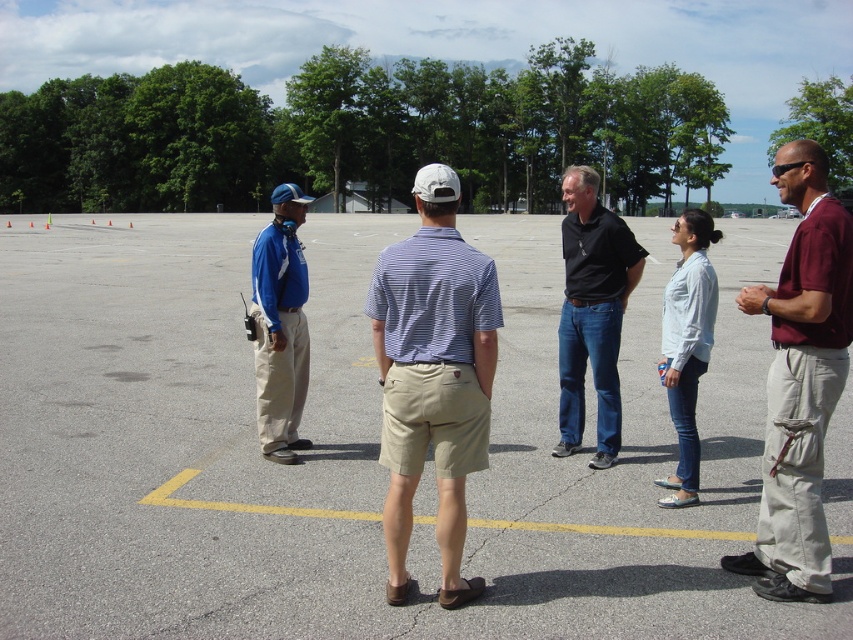
Question: Does maroon cotton shirt at right have a larger size compared to matte khaki pants at left?

Choices:
 (A) yes
 (B) no

Answer: (A)

Question: Is khaki shorts at center bigger than maroon cotton shirt at right?

Choices:
 (A) yes
 (B) no

Answer: (B)

Question: Which object is the farthest from the khaki shorts at center?

Choices:
 (A) gray asphalt parking lot at center
 (B) matte khaki pants at left

Answer: (A)

Question: Which point is closer to the camera taking this photo?

Choices:
 (A) pos(606,285)
 (B) pos(372,289)

Answer: (B)

Question: Estimate the real-world distances between objects in this image. Which object is farther from the black cotton shirt at center?

Choices:
 (A) matte khaki pants at left
 (B) maroon cotton shirt at right
 (C) khaki shorts at center
 (D) gray asphalt parking lot at center

Answer: (D)

Question: Can you confirm if gray asphalt parking lot at center is positioned to the right of khaki shorts at center?

Choices:
 (A) yes
 (B) no

Answer: (A)